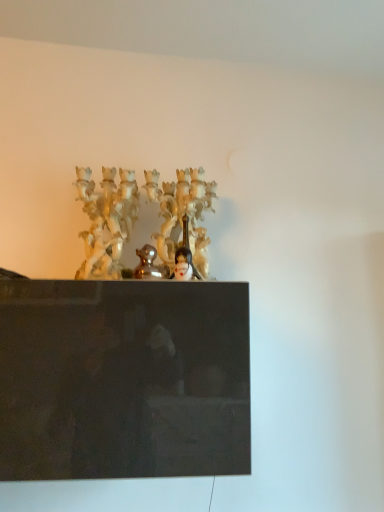
Measure the distance between point (146, 251) and camera.

They are 1.01 meters apart.

Describe the element at coordinates (149, 265) in the screenshot. I see `shiny gold duckling at center` at that location.

Locate an element on the screen. shiny gold duckling at center is located at coordinates (149, 265).

Locate an element on the screen. smooth porcelain figurine at center is located at coordinates (184, 265).

The image size is (384, 512). What do you see at coordinates (184, 265) in the screenshot?
I see `smooth porcelain figurine at center` at bounding box center [184, 265].

In order to face smooth porcelain figurine at center, should I rotate leftwards or rightwards?

Rotate left and turn 1.453 degrees.

The image size is (384, 512). What are the coordinates of `shiny gold duckling at center` in the screenshot? It's located at (149, 265).

Considering the positions of objects shiny gold duckling at center and smooth porcelain figurine at center in the image provided, who is more to the right, shiny gold duckling at center or smooth porcelain figurine at center?

From the viewer's perspective, smooth porcelain figurine at center appears more on the right side.

Consider the image. Who is more distant, shiny gold duckling at center or smooth porcelain figurine at center?

Positioned behind is smooth porcelain figurine at center.

Considering the points (146, 246) and (191, 266), which point is in front, point (146, 246) or point (191, 266)?

Positioned in front is point (146, 246).

From the image's perspective, does shiny gold duckling at center appear lower than smooth porcelain figurine at center?

Actually, shiny gold duckling at center appears above smooth porcelain figurine at center in the image.

From a real-world perspective, does shiny gold duckling at center stand above smooth porcelain figurine at center?

Correct, in the physical world, shiny gold duckling at center is higher than smooth porcelain figurine at center.

Is shiny gold duckling at center thinner than smooth porcelain figurine at center?

No, shiny gold duckling at center is not thinner than smooth porcelain figurine at center.

Between shiny gold duckling at center and smooth porcelain figurine at center, which one has less height?

With less height is smooth porcelain figurine at center.

Looking at the image, does shiny gold duckling at center seem bigger or smaller compared to smooth porcelain figurine at center?

Clearly, shiny gold duckling at center is larger in size than smooth porcelain figurine at center.

Is shiny gold duckling at center situated inside smooth porcelain figurine at center or outside?

shiny gold duckling at center exists outside the volume of smooth porcelain figurine at center.

Is there a large distance between shiny gold duckling at center and smooth porcelain figurine at center?

They are positioned close to each other.

Is shiny gold duckling at center oriented towards smooth porcelain figurine at center?

No, shiny gold duckling at center is not aimed at smooth porcelain figurine at center.

Can you tell me how much shiny gold duckling at center and smooth porcelain figurine at center differ in facing direction?

0.00665 degrees.

Measure the distance from shiny gold duckling at center to smooth porcelain figurine at center.

shiny gold duckling at center and smooth porcelain figurine at center are 5.83 centimeters apart.

Image resolution: width=384 pixels, height=512 pixels. In order to click on sculpture located on the left of smooth porcelain figurine at center in this screenshot , I will do `click(149, 265)`.

Can you confirm if smooth porcelain figurine at center is positioned to the left of shiny gold duckling at center?

In fact, smooth porcelain figurine at center is to the right of shiny gold duckling at center.

Which object is further away from the camera, smooth porcelain figurine at center or shiny gold duckling at center?

Positioned behind is smooth porcelain figurine at center.

Does point (199, 279) come farther from viewer compared to point (149, 247)?

No, it is in front of (149, 247).

From the image's perspective, is smooth porcelain figurine at center located above or below shiny gold duckling at center?

smooth porcelain figurine at center is situated lower than shiny gold duckling at center in the image.

From the picture: From a real-world perspective, is smooth porcelain figurine at center positioned under shiny gold duckling at center based on gravity?

Indeed, from a real-world perspective, smooth porcelain figurine at center is positioned beneath shiny gold duckling at center.

Based on the photo, is smooth porcelain figurine at center thinner than shiny gold duckling at center?

Indeed, smooth porcelain figurine at center has a lesser width compared to shiny gold duckling at center.

Is smooth porcelain figurine at center taller than shiny gold duckling at center?

Incorrect, the height of smooth porcelain figurine at center is not larger of that of shiny gold duckling at center.

Is smooth porcelain figurine at center bigger or smaller than shiny gold duckling at center?

Considering their sizes, smooth porcelain figurine at center takes up less space than shiny gold duckling at center.

Is smooth porcelain figurine at center completely or partially outside of shiny gold duckling at center?

That's correct, smooth porcelain figurine at center is outside of shiny gold duckling at center.

Consider the image. Would you consider smooth porcelain figurine at center to be distant from shiny gold duckling at center?

No, smooth porcelain figurine at center is not far from shiny gold duckling at center.

Is smooth porcelain figurine at center turned away from shiny gold duckling at center?

smooth porcelain figurine at center is not turned away from shiny gold duckling at center.

How many degrees apart are the facing directions of smooth porcelain figurine at center and shiny gold duckling at center?

smooth porcelain figurine at center and shiny gold duckling at center are facing 0.00665 degrees away from each other.

How distant is smooth porcelain figurine at center from shiny gold duckling at center?

2.29 inches.

In order to click on sculpture in front of the smooth porcelain figurine at center in this screenshot , I will do `click(149, 265)`.

Image resolution: width=384 pixels, height=512 pixels. I want to click on sculpture that is above the smooth porcelain figurine at center (from a real-world perspective), so click(149, 265).

Where is `person behind the shiny gold duckling at center`? Image resolution: width=384 pixels, height=512 pixels. person behind the shiny gold duckling at center is located at coordinates (184, 265).